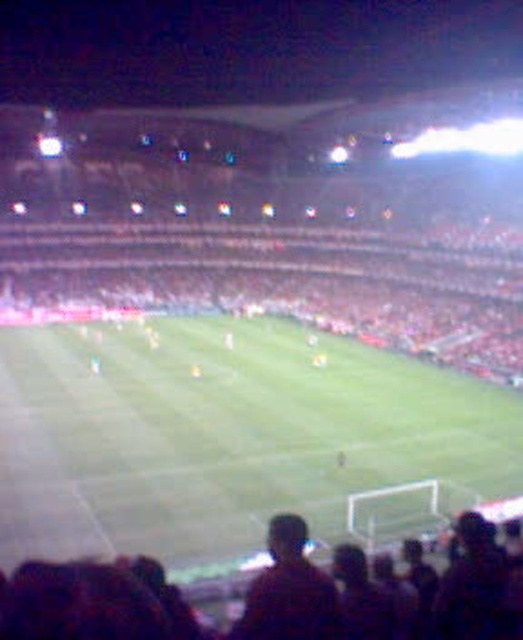
You are a photographer trying to capture a clear shot of the dark brown hair at lower center and the green grass football field at center. Which object is blocking your view of the other?

The dark brown hair at lower center is behind the green grass football field at center, so the green grass football field at center is blocking the view of the dark brown hair at lower center.

Looking at this image, you are a photographer trying to capture a photo of both dark brown hair at lower center and dark brown hair at center in the soccer stadium. Which of the two dark brown hair subjects should you focus on first to ensure they are in frame and properly sized?

The dark brown hair at lower center has a larger size compared to dark brown hair at center, so you should focus on the dark brown hair at lower center first to ensure proper sizing and framing in the photo.